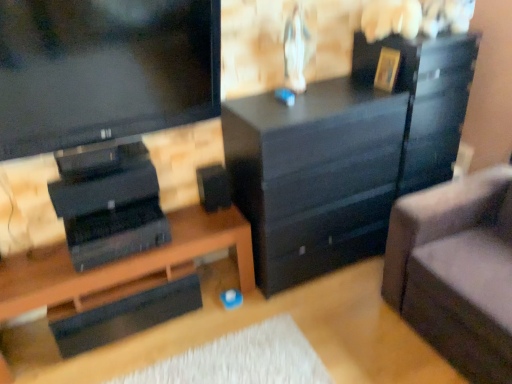
Question: In terms of size, does black matte speaker at center appear bigger or smaller than black matte chest of drawers at center?

Choices:
 (A) big
 (B) small

Answer: (B)

Question: From the image's perspective, is black matte speaker at center positioned above or below black matte chest of drawers at center?

Choices:
 (A) above
 (B) below

Answer: (B)

Question: Considering the real-world distances, which object is farthest from the gold metallic picture frame at upper right?

Choices:
 (A) black matte chest of drawers at center
 (B) black matte desk at lower left
 (C) suede gray couch at right
 (D) black matte speaker at center
 (E) glossy black file cabinet at right

Answer: (B)

Question: Which object is the closest to the black matte chest of drawers at center?

Choices:
 (A) gold metallic picture frame at upper right
 (B) black matte desk at lower left
 (C) suede gray couch at right
 (D) black matte speaker at center
 (E) glossy black file cabinet at right

Answer: (E)